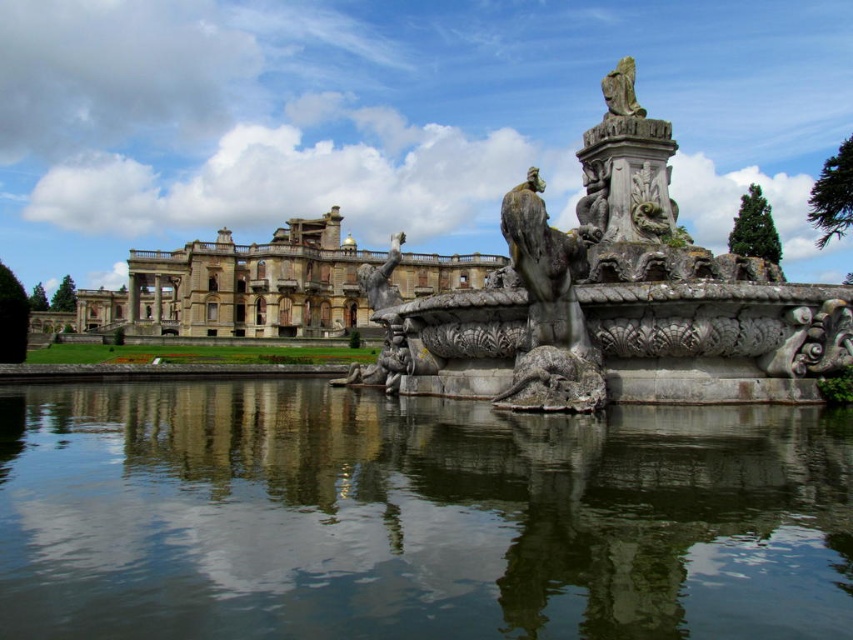
You are standing in front of the beige stone palace at center and want to see the gray stone fountain at center. Which direction should you turn your head to look towards it?

The gray stone fountain at center is to the right of beige stone palace at center, so you should turn your head to the right to look towards it.

You are an architect visiting the site and need to determine which structure is wider. You see the gray stone fountain at center and the beige stone palace at center. Which one is wider?

The beige stone palace at center is wider than the gray stone fountain at center.